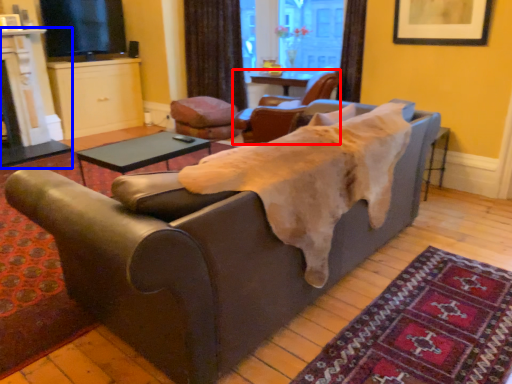
Question: Which object is further to the camera taking this photo, chair (highlighted by a red box) or fireplace (highlighted by a blue box)?

Choices:
 (A) chair
 (B) fireplace

Answer: (B)